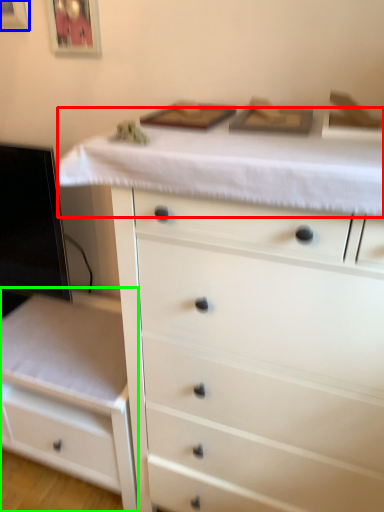
Question: Estimate the real-world distances between objects in this image. Which object is closer to counter top (highlighted by a red box), picture frame (highlighted by a blue box) or chest of drawers (highlighted by a green box)?

Choices:
 (A) picture frame
 (B) chest of drawers

Answer: (B)